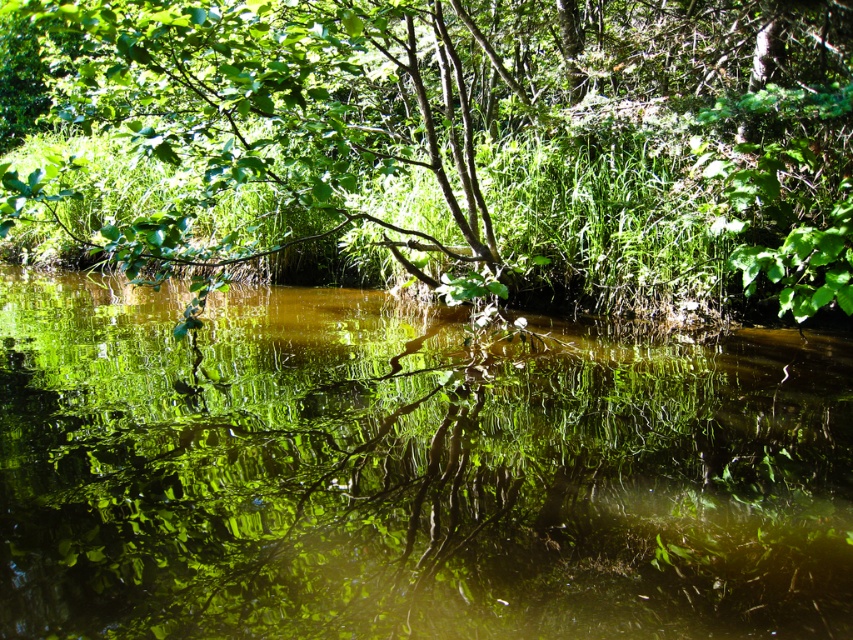
Question: Which point is closer to the camera?

Choices:
 (A) green leafy tree at center
 (B) green reflective water at center

Answer: (B)

Question: Among these objects, which one is farthest from the camera?

Choices:
 (A) green reflective water at center
 (B) green leafy tree at center

Answer: (B)

Question: Is green reflective water at center to the right of green leafy tree at center from the viewer's perspective?

Choices:
 (A) yes
 (B) no

Answer: (A)

Question: Is green reflective water at center to the left of green leafy tree at center from the viewer's perspective?

Choices:
 (A) no
 (B) yes

Answer: (A)

Question: Is green reflective water at center positioned before green leafy tree at center?

Choices:
 (A) yes
 (B) no

Answer: (A)

Question: Which point is closer to the camera?

Choices:
 (A) (587, 508)
 (B) (51, 100)

Answer: (A)